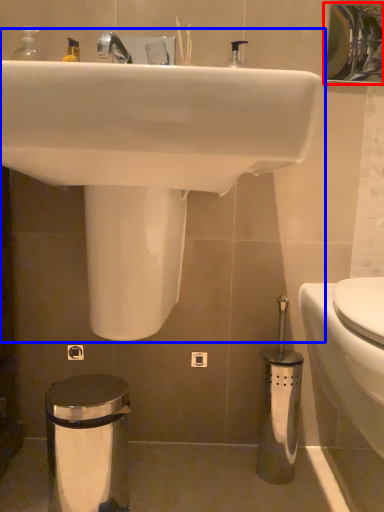
Question: Which of the following is the closest to the observer, mirror (highlighted by a red box) or sink (highlighted by a blue box)?

Choices:
 (A) mirror
 (B) sink

Answer: (B)